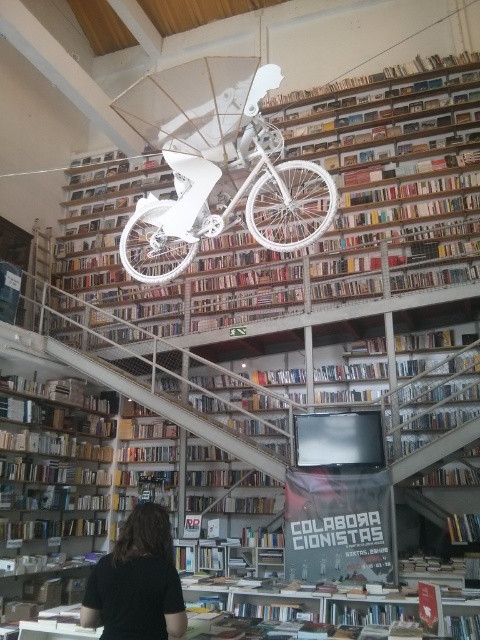
You are a customer in the bookstore and want to reach the books on the white matte bookcase at center. Which direction should you move relative to the wooden bookshelf at lower left?

The white matte bookcase at center is located above the wooden bookshelf at lower left, so you should move upward from the wooden bookshelf at lower left to reach it.

You are standing in the bookstore and see the white matte bicycle at center and the black shirt at lower center. Which object is positioned to the right of the other?

The white matte bicycle at center is to the right of the black shirt at lower center.